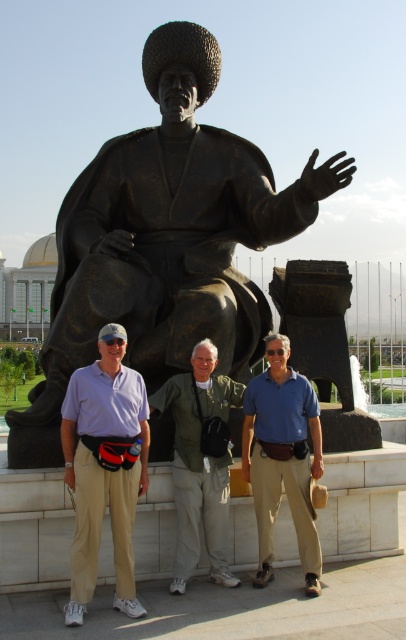
Between point (218, 547) and point (97, 365), which one is positioned behind?

Positioned behind is point (97, 365).

Can you confirm if matte black statue at center is wider than matte purple shirt at center?

Correct, the width of matte black statue at center exceeds that of matte purple shirt at center.

Locate an element on the screen. The image size is (406, 640). matte black statue at center is located at coordinates (136, 467).

Does bronze statue at center have a lesser height compared to green fabric jacket at center?

No.

Who is lower down, bronze statue at center or green fabric jacket at center?

Positioned lower is green fabric jacket at center.

You are a GUI agent. You are given a task and a screenshot of the screen. Output one action in this format:
    pyautogui.click(x=<x>, y=<y>)
    Task: Click on the bronze statue at center
    
    Given the screenshot: What is the action you would take?
    pyautogui.click(x=164, y=241)

The width and height of the screenshot is (406, 640). What are the coordinates of `bronze statue at center` in the screenshot? It's located at tap(164, 241).

Locate an element on the screen. matte purple shirt at center is located at coordinates (105, 468).

Who is higher up, matte purple shirt at center or blue cotton shirt at center?

matte purple shirt at center is above.

Which is in front, point (105, 490) or point (306, 428)?

Point (105, 490) is more forward.

Locate an element on the screen. The image size is (406, 640). matte purple shirt at center is located at coordinates (105, 468).